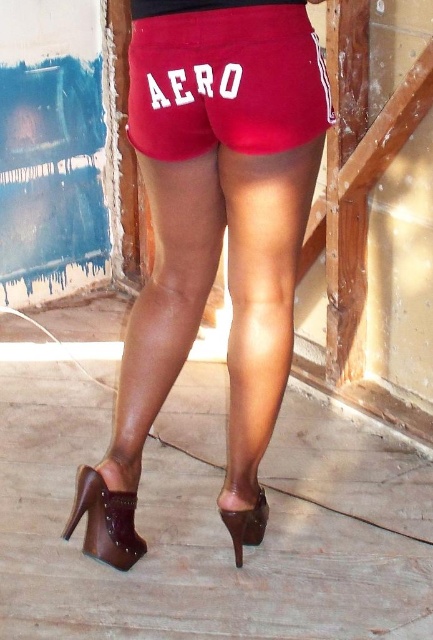
Which is more to the left, matte red shorts at center or brown leather high-heeled shoe at lower left?

From the viewer's perspective, brown leather high-heeled shoe at lower left appears more on the left side.

Between matte red shorts at center and brown leather high-heeled shoe at lower left, which one is positioned lower?

brown leather high-heeled shoe at lower left

What do you see at coordinates (226, 81) in the screenshot? The height and width of the screenshot is (640, 433). I see `matte red shorts at center` at bounding box center [226, 81].

I want to click on matte red shorts at center, so click(x=226, y=81).

Is point (258, 36) closer to viewer compared to point (248, 516)?

Yes, point (258, 36) is in front of point (248, 516).

Is point (241, 384) positioned behind point (259, 516)?

No.

Between point (291, 337) and point (257, 516), which one is positioned in front?

Positioned in front is point (291, 337).

Identify the location of matte leather shorts at center. Image resolution: width=433 pixels, height=640 pixels. (212, 230).

Is point (142, 84) farther from camera compared to point (255, 508)?

No, (142, 84) is closer to viewer.

Find the location of a particular element. Image resolution: width=433 pixels, height=640 pixels. matte red shorts at center is located at coordinates (226, 81).

The height and width of the screenshot is (640, 433). Identify the location of matte red shorts at center. (226, 81).